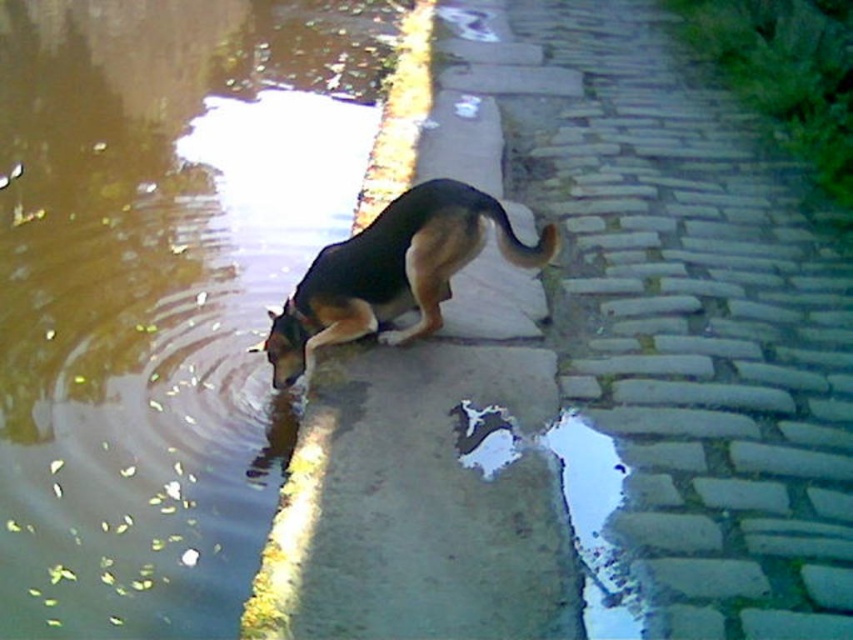
Question: Is brick pavement at center above black and tan fur dog at center?

Choices:
 (A) no
 (B) yes

Answer: (B)

Question: Which of the following is the closest to the observer?

Choices:
 (A) brown water at edge left
 (B) brick pavement at center

Answer: (B)

Question: Considering the real-world distances, which object is closest to the black and tan fur dog at center?

Choices:
 (A) brown water at edge left
 (B) brick pavement at center

Answer: (B)

Question: Which point is farther to the camera?

Choices:
 (A) brown water at edge left
 (B) brick pavement at center

Answer: (A)

Question: Is brick pavement at center positioned behind black and tan fur dog at center?

Choices:
 (A) yes
 (B) no

Answer: (A)

Question: Is brick pavement at center to the right of black and tan fur dog at center from the viewer's perspective?

Choices:
 (A) no
 (B) yes

Answer: (B)